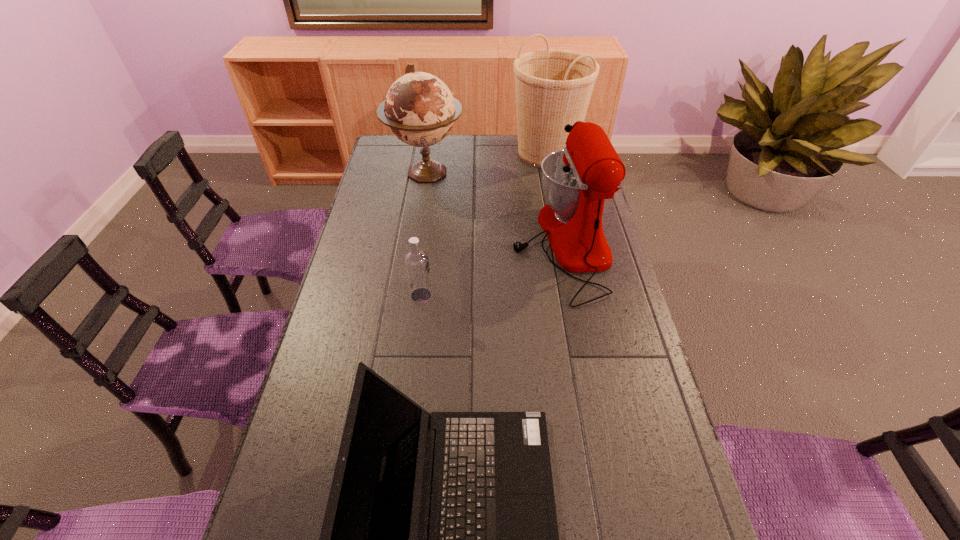
The height and width of the screenshot is (540, 960). Find the location of `basket located at the far edge`. basket located at the far edge is located at coordinates (553, 87).

I want to click on globe that is at the far edge, so click(420, 110).

This screenshot has width=960, height=540. What are the coordinates of `object at the left edge` in the screenshot? It's located at (420, 110).

You are a GUI agent. You are given a task and a screenshot of the screen. Output one action in this format:
    pyautogui.click(x=<x>, y=<y>)
    Task: Click on the basket present at the right edge
    
    Given the screenshot: What is the action you would take?
    pyautogui.click(x=553, y=87)

Find the location of a particular element. The image size is (960, 540). mixer at the right edge is located at coordinates (576, 180).

At what (x,y) coordinates should I click in order to perform the action: click on object that is at the far left corner. Please return your answer as a coordinate pair (x, y). The height and width of the screenshot is (540, 960). Looking at the image, I should click on (420, 110).

I want to click on object located at the far right corner, so click(x=553, y=87).

Find the location of `free space at the far edge of the desktop`. free space at the far edge of the desktop is located at coordinates (506, 155).

The image size is (960, 540). I want to click on free space at the left edge of the desktop, so click(x=378, y=207).

The width and height of the screenshot is (960, 540). In order to click on free space at the right edge of the desktop in this screenshot , I will do `click(647, 368)`.